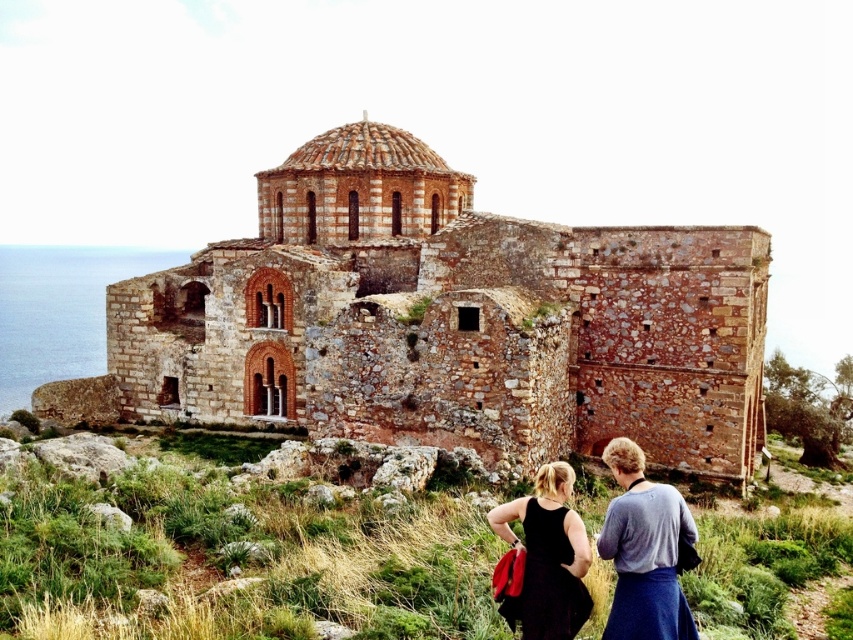
Measure the distance between rustic stone church at center and black fabric dress at lower right.

rustic stone church at center and black fabric dress at lower right are 62.55 feet apart.

Who is shorter, rustic stone church at center or black fabric dress at lower right?

black fabric dress at lower right is shorter.

This screenshot has height=640, width=853. What are the coordinates of `rustic stone church at center` in the screenshot? It's located at (451, 321).

At what (x,y) coordinates should I click in order to perform the action: click on rustic stone church at center. Please return your answer as a coordinate pair (x, y). This screenshot has width=853, height=640. Looking at the image, I should click on (451, 321).

Who is more forward, (759,296) or (619,560)?

Positioned in front is point (619,560).

At what (x,y) coordinates should I click in order to perform the action: click on rustic stone church at center. Please return your answer as a coordinate pair (x, y). Looking at the image, I should click on (451, 321).

Is point (329, 408) farther from camera compared to point (691, 628)?

That is True.

The height and width of the screenshot is (640, 853). I want to click on rustic stone church at center, so click(x=451, y=321).

Looking at this image, which of these two, black fabric dress at lower center or black fabric dress at lower right, stands shorter?

black fabric dress at lower right is shorter.

What do you see at coordinates (643, 550) in the screenshot? I see `black fabric dress at lower center` at bounding box center [643, 550].

Identify the location of black fabric dress at lower center. The width and height of the screenshot is (853, 640). (643, 550).